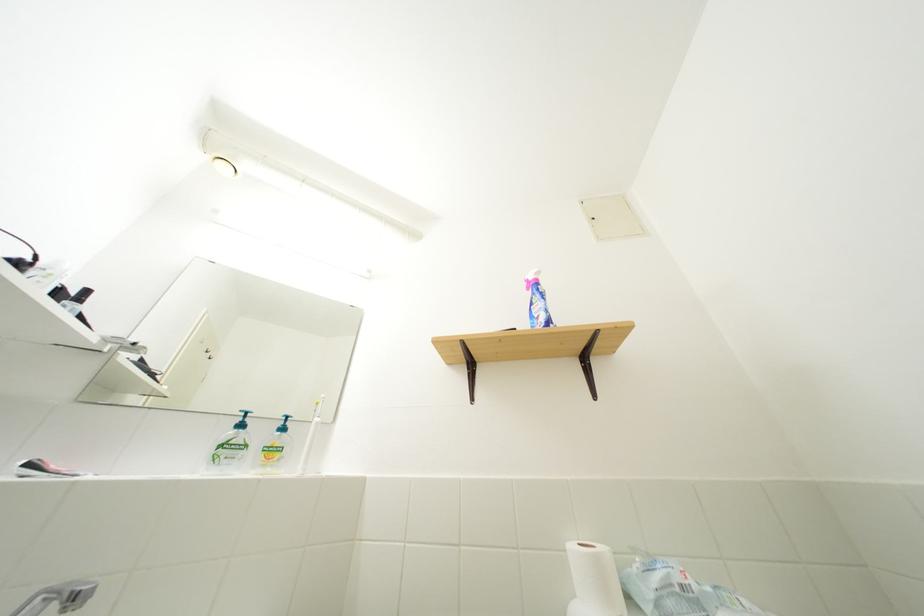
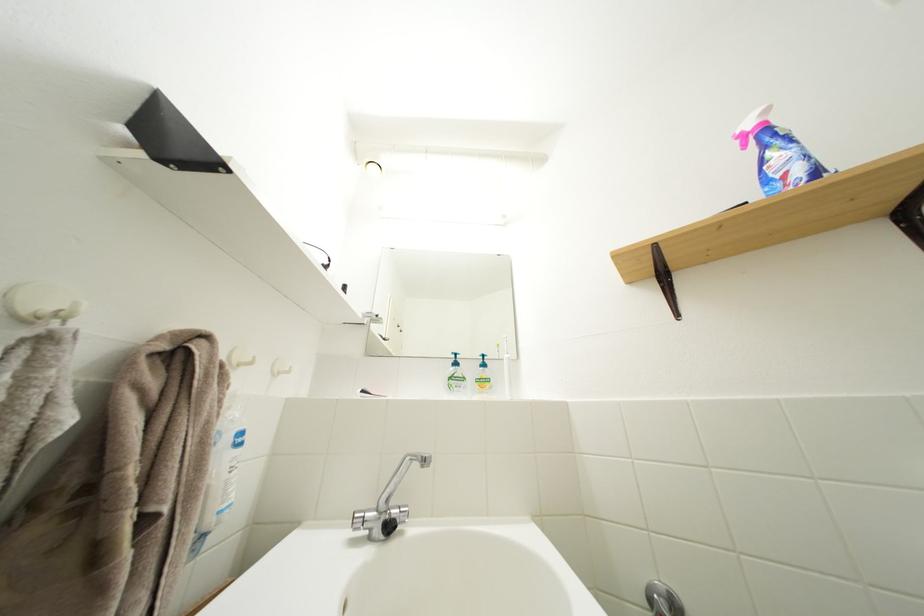
The point at (270, 440) is marked in the first image. Where is the corresponding point in the second image?

(479, 376)